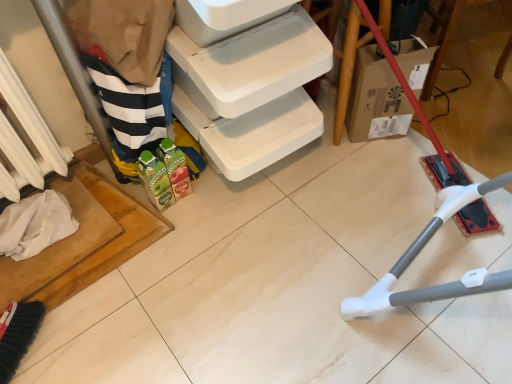
Question: Is cardboard box at lower right inside or outside of white plastic shelf at lower left?

Choices:
 (A) outside
 (B) inside

Answer: (A)

Question: Looking at the image, does cardboard box at lower right seem bigger or smaller compared to white plastic shelf at lower left?

Choices:
 (A) small
 (B) big

Answer: (A)

Question: Estimate the real-world distances between objects in this image. Which object is closer to the cardboard box at lower right?

Choices:
 (A) white plastic shelf at lower left
 (B) white painted metal radiator at left

Answer: (A)

Question: Which is nearer to the cardboard box at lower right?

Choices:
 (A) white plastic shelf at lower left
 (B) white painted metal radiator at left

Answer: (A)